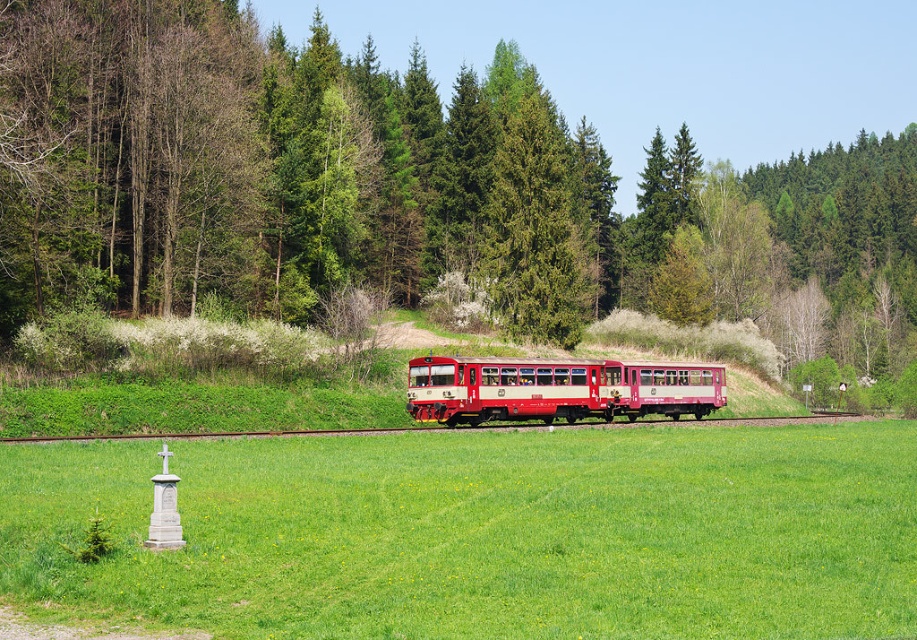
Consider the image. Does green grassy field at lower center appear on the left side of green textured pine tree at center?

Correct, you'll find green grassy field at lower center to the left of green textured pine tree at center.

Can you confirm if green grassy field at lower center is wider than green textured pine tree at center?

Indeed, green grassy field at lower center has a greater width compared to green textured pine tree at center.

Between point (494, 560) and point (542, 234), which one is positioned in front?

Point (494, 560) is more forward.

This screenshot has width=917, height=640. Find the location of `green grassy field at lower center`. green grassy field at lower center is located at coordinates (483, 532).

In the scene shown: Is green grassy field at lower center above matte red train at center?

Yes, green grassy field at lower center is above matte red train at center.

You are a GUI agent. You are given a task and a screenshot of the screen. Output one action in this format:
    pyautogui.click(x=<x>, y=<y>)
    Task: Click on the green grassy field at lower center
    The width and height of the screenshot is (917, 640).
    Given the screenshot: What is the action you would take?
    pyautogui.click(x=483, y=532)

Which of these two, green textured pine tree at center or matte red train at center, stands taller?

With more height is green textured pine tree at center.

Where is `green textured pine tree at center`? This screenshot has width=917, height=640. green textured pine tree at center is located at coordinates (536, 227).